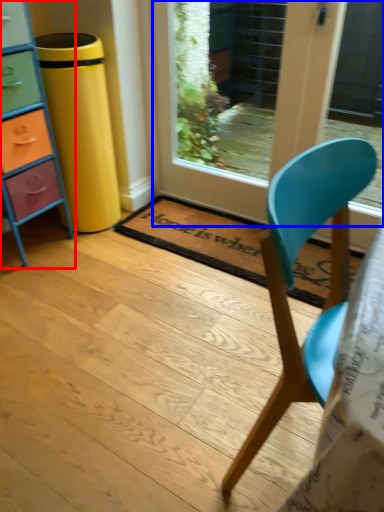
Question: Which of the following is the farthest to the observer, chest of drawers (highlighted by a red box) or door (highlighted by a blue box)?

Choices:
 (A) chest of drawers
 (B) door

Answer: (B)